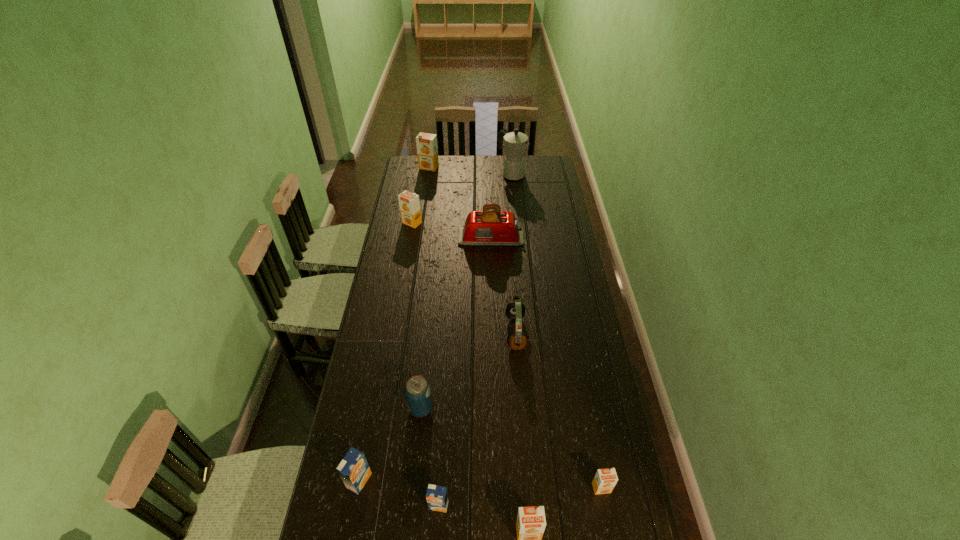
At what (x,y) coordinates should I click in order to perform the action: click on object that is at the far left corner. Please return your answer as a coordinate pair (x, y). Looking at the image, I should click on (427, 150).

Find the location of a particular element. Image resolution: width=960 pixels, height=540 pixels. free region at the far edge is located at coordinates click(x=467, y=168).

Find the location of a particular element. The width and height of the screenshot is (960, 540). vacant point at the left edge is located at coordinates (385, 270).

At what (x,y) coordinates should I click in order to perform the action: click on vacant region at the right edge of the desktop. Please return your answer as a coordinate pair (x, y). The image size is (960, 540). Looking at the image, I should click on (543, 271).

This screenshot has width=960, height=540. I want to click on blank space at the far left corner of the desktop, so click(x=413, y=163).

Locate an element on the screen. The image size is (960, 540). unoccupied area between the fifth shortest orange_juice and the rightmost orange orange juice is located at coordinates (507, 355).

The image size is (960, 540). What are the coordinates of `blank region between the left blue orange_juice and the biggest orange orange juice` in the screenshot? It's located at (395, 324).

At what (x,y) coordinates should I click in order to perform the action: click on blank region between the rightmost orange orange juice and the fifth farthest object. Please return your answer as a coordinate pair (x, y). Looking at the image, I should click on (559, 410).

Find the location of a particular element. This screenshot has width=960, height=540. vacant space that is in between the fifth nearest object and the gray coffeepot is located at coordinates (467, 291).

The image size is (960, 540). In order to click on free space between the biggest orange orange juice and the tallest object in this screenshot , I will do coord(470,171).